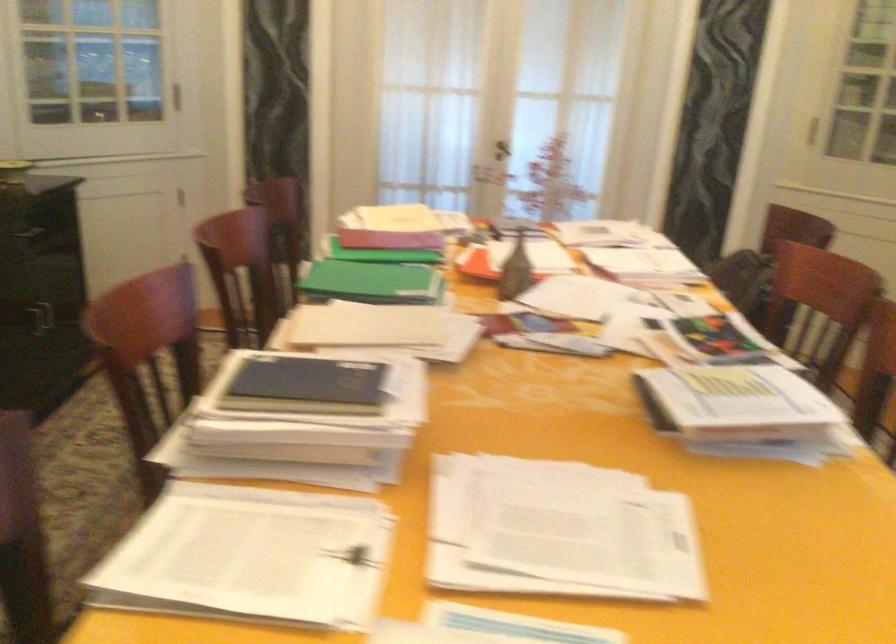
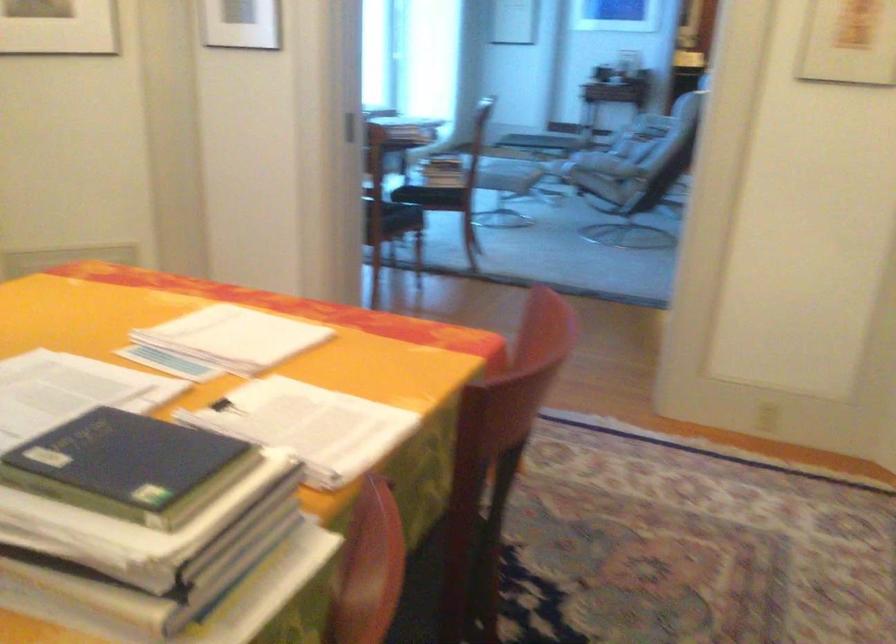
Where in the second image is the point corresponding to [472,573] from the first image?

(226, 408)